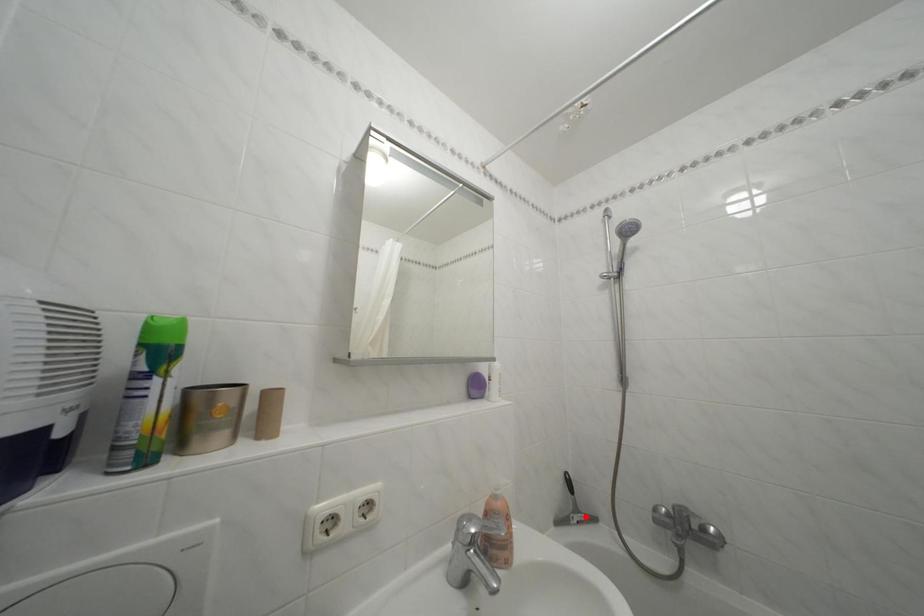
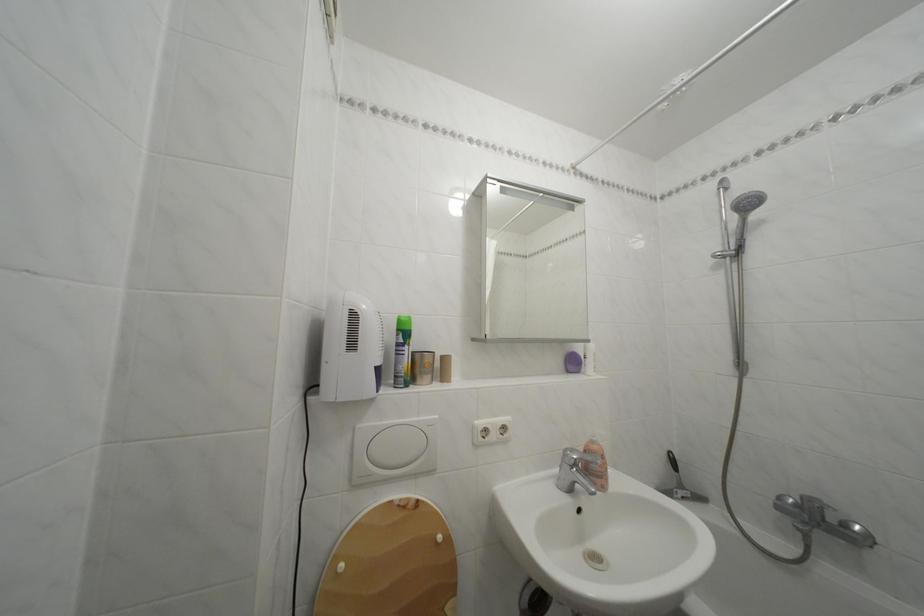
Find the pixel in the second image that matches the highlighted location in the first image.

(689, 492)